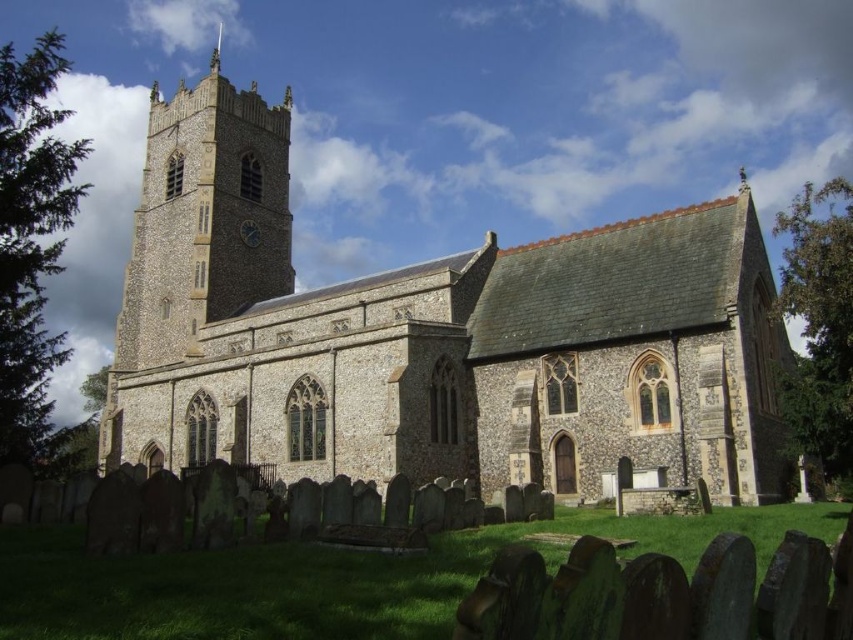
Is point (775, 417) less distant than point (169, 298)?

Yes, point (775, 417) is closer to viewer.

Who is more distant from viewer, (177, 284) or (138, 262)?

The point (138, 262) is behind.

Identify the location of stone church at center. (437, 339).

Image resolution: width=853 pixels, height=640 pixels. What are the coordinates of `stone church at center` in the screenshot? It's located at (437, 339).

Can you confirm if stone church at center is taller than dark brown wooden clock at upper center?

Indeed, stone church at center has a greater height compared to dark brown wooden clock at upper center.

Who is more forward, [486,454] or [241,221]?

Point [486,454] is more forward.

Where is `stone church at center`? This screenshot has height=640, width=853. stone church at center is located at coordinates (437, 339).

Consider the image. Can you confirm if beige stone clock tower at upper left is taller than dark brown wooden clock at upper center?

Indeed, beige stone clock tower at upper left has a greater height compared to dark brown wooden clock at upper center.

Which is more to the left, beige stone clock tower at upper left or dark brown wooden clock at upper center?

Positioned to the left is beige stone clock tower at upper left.

I want to click on beige stone clock tower at upper left, so click(204, 220).